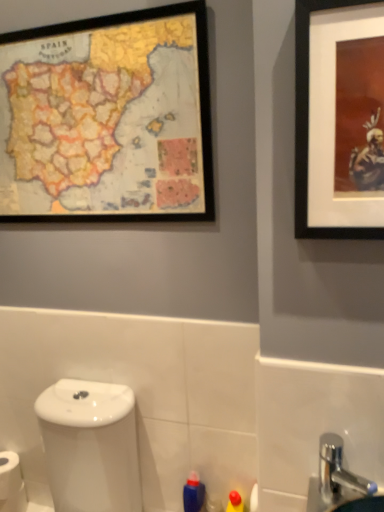
Question: From the image's perspective, is wooden map at upper left, acting as the first picture frame starting from the back, positioned above or below black matte picture frame at upper right, the second picture frame positioned from the back?

Choices:
 (A) below
 (B) above

Answer: (B)

Question: Considering the positions of wooden map at upper left, acting as the first picture frame starting from the back, and black matte picture frame at upper right, which is the 1th picture frame from right to left, in the image, is wooden map at upper left, acting as the first picture frame starting from the back, wider or thinner than black matte picture frame at upper right, which is the 1th picture frame from right to left,?

Choices:
 (A) wide
 (B) thin

Answer: (B)

Question: Based on their relative distances, which object is nearer to the white matte toilet paper at lower left?

Choices:
 (A) silver metallic faucet at lower right
 (B) wooden map at upper left, acting as the 1th picture frame starting from the left
 (C) white glossy toilet at lower left
 (D) blue plastic bottle at lower center
 (E) black matte picture frame at upper right, which is the 1th picture frame from right to left

Answer: (C)

Question: Which object is positioned closest to the wooden map at upper left, acting as the first picture frame starting from the back?

Choices:
 (A) white glossy toilet at lower left
 (B) silver metallic faucet at lower right
 (C) white matte toilet paper at lower left
 (D) black matte picture frame at upper right, which is counted as the first picture frame, starting from the front
 (E) blue plastic bottle at lower center

Answer: (D)